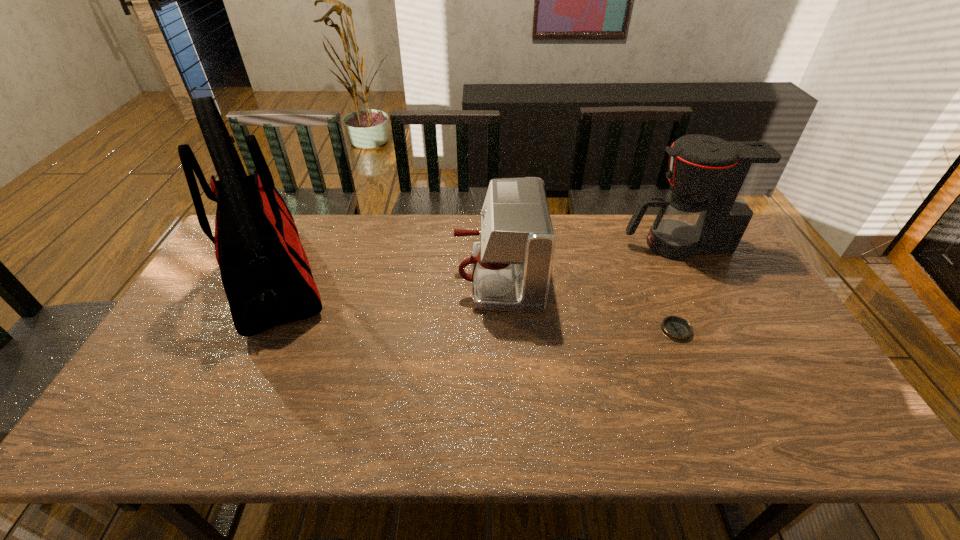
At what (x,y) coordinates should I click in order to perform the action: click on vacant area at the far edge. Please return your answer as a coordinate pair (x, y). Looking at the image, I should click on (582, 256).

This screenshot has height=540, width=960. In the image, there is a desktop. Identify the location of free space at the near edge. click(x=321, y=424).

In the image, there is a desktop. Identify the location of vacant space at the left edge. Image resolution: width=960 pixels, height=540 pixels. (138, 386).

The width and height of the screenshot is (960, 540). In order to click on vacant area at the right edge of the desktop in this screenshot , I will do `click(732, 278)`.

At what (x,y) coordinates should I click in order to perform the action: click on vacant region at the near right corner. Please return your answer as a coordinate pair (x, y). This screenshot has width=960, height=540. Looking at the image, I should click on (836, 431).

The height and width of the screenshot is (540, 960). What are the coordinates of `free spot between the third object from right to left and the third shortest object` in the screenshot? It's located at (588, 261).

The height and width of the screenshot is (540, 960). Identify the location of free space between the third tallest object and the leftmost object. (386, 278).

What are the coordinates of `vacant space in between the second tallest object and the compass` in the screenshot? It's located at (676, 287).

You are a GUI agent. You are given a task and a screenshot of the screen. Output one action in this format:
    pyautogui.click(x=<x>, y=<y>)
    Task: Click on the empty space that is in between the shortest object and the second object from left to right
    
    Given the screenshot: What is the action you would take?
    pyautogui.click(x=587, y=304)

The width and height of the screenshot is (960, 540). I want to click on empty space that is in between the second shortest object and the taller coffee maker, so click(x=588, y=261).